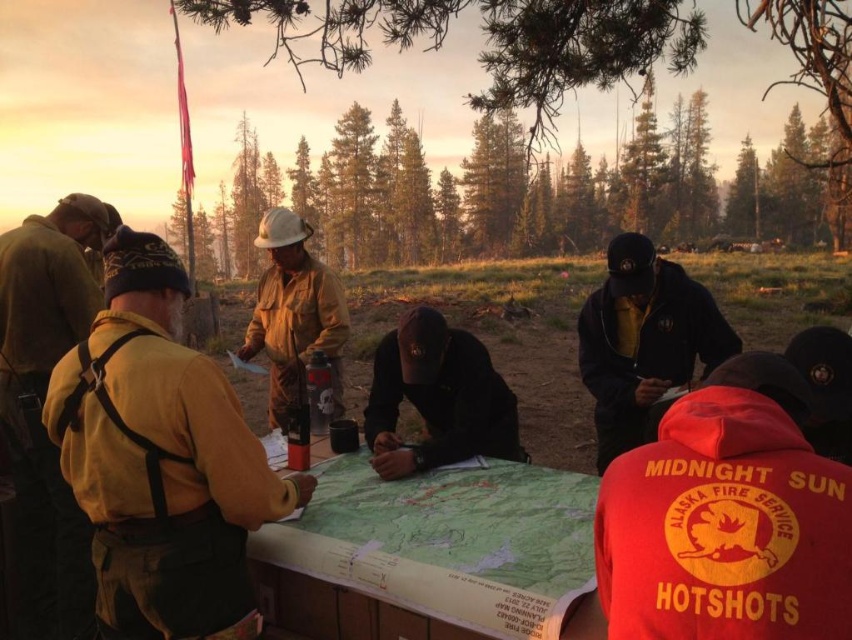
Question: Is green paper map at center above black matte cap at center?

Choices:
 (A) yes
 (B) no

Answer: (B)

Question: Which is nearer to the green paper map at center?

Choices:
 (A) black matte jacket at center
 (B) yellow fabric jacket at center
 (C) yellow fabric vest at left

Answer: (B)

Question: Which point appears farthest from the camera in this image?

Choices:
 (A) (101, 586)
 (B) (389, 364)
 (C) (286, 356)

Answer: (C)

Question: Can you confirm if black matte jacket at center is smaller than black matte cap at center?

Choices:
 (A) no
 (B) yes

Answer: (A)

Question: Which point is closer to the camera taking this photo?

Choices:
 (A) (628, 268)
 (B) (281, 221)

Answer: (A)

Question: Is yellow fabric jacket at center bigger than black matte jacket at center?

Choices:
 (A) yes
 (B) no

Answer: (B)